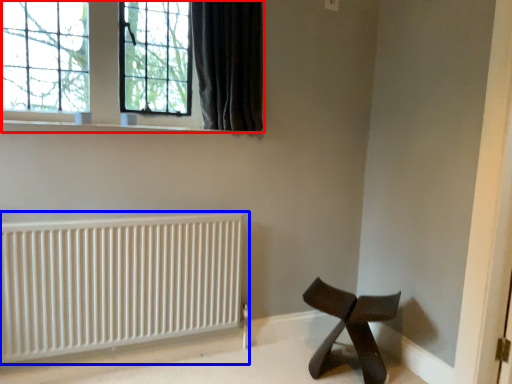
Question: Among these objects, which one is nearest to the camera, window (highlighted by a red box) or radiator (highlighted by a blue box)?

Choices:
 (A) window
 (B) radiator

Answer: (B)